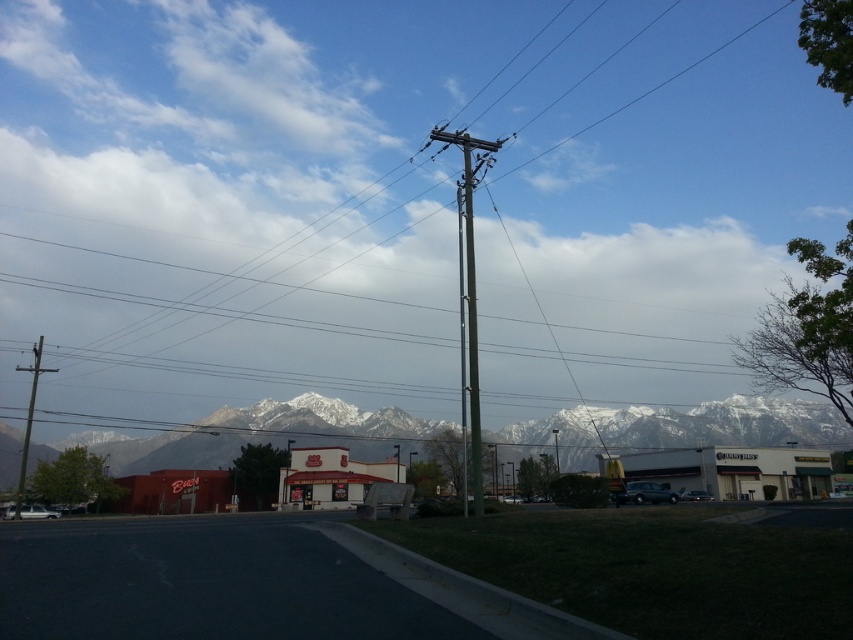
You are standing at the point marked at coordinates point (679, 428) in the image. Based on the scene description, what terrain or feature would you be standing on?

The point (679, 428) is on snowy white mountains at center, so you would be standing on the snowy white mountains at center.